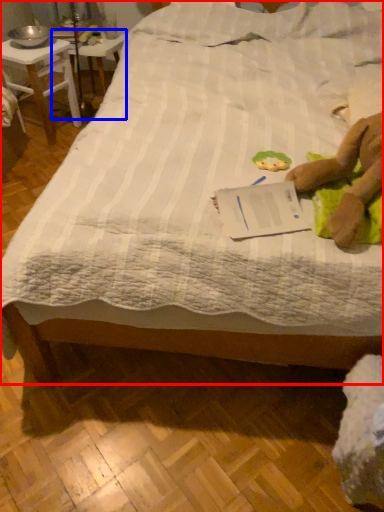
Question: Which of the following is the farthest to the observer, bed (highlighted by a red box) or table (highlighted by a blue box)?

Choices:
 (A) bed
 (B) table

Answer: (B)